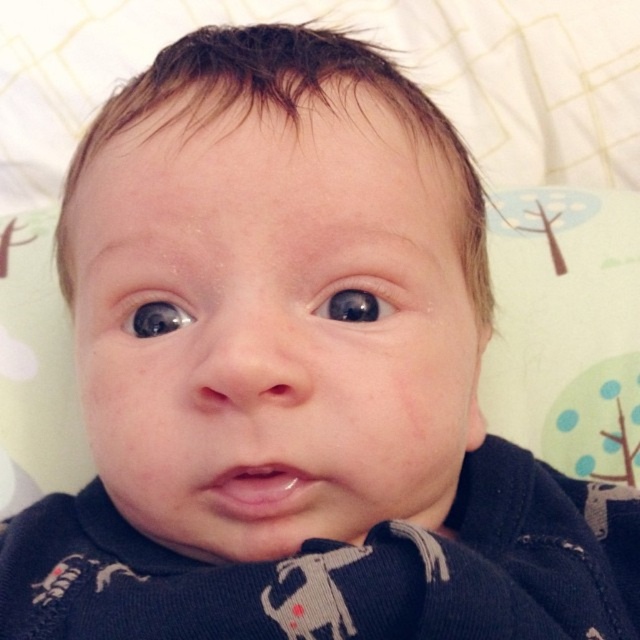
You are a photographer adjusting the focus on your camera. You notice two points in the image, point (387, 300) and point (184, 317). Which point should you focus on first if you want to ensure the baby is in sharp focus?

Point (387, 300) is closer to the viewer than point (184, 317), so focusing on point (387, 300) first will ensure the baby is in sharp focus.